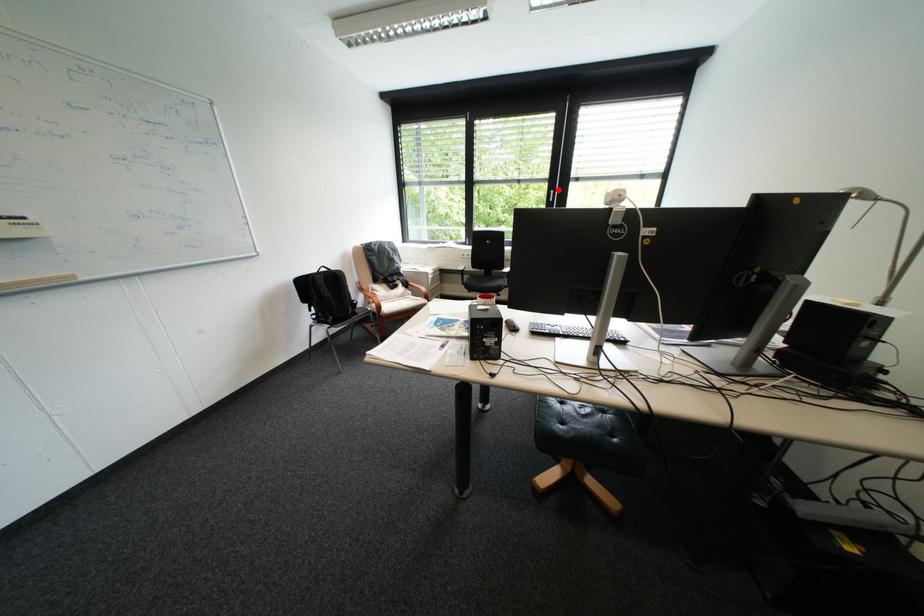
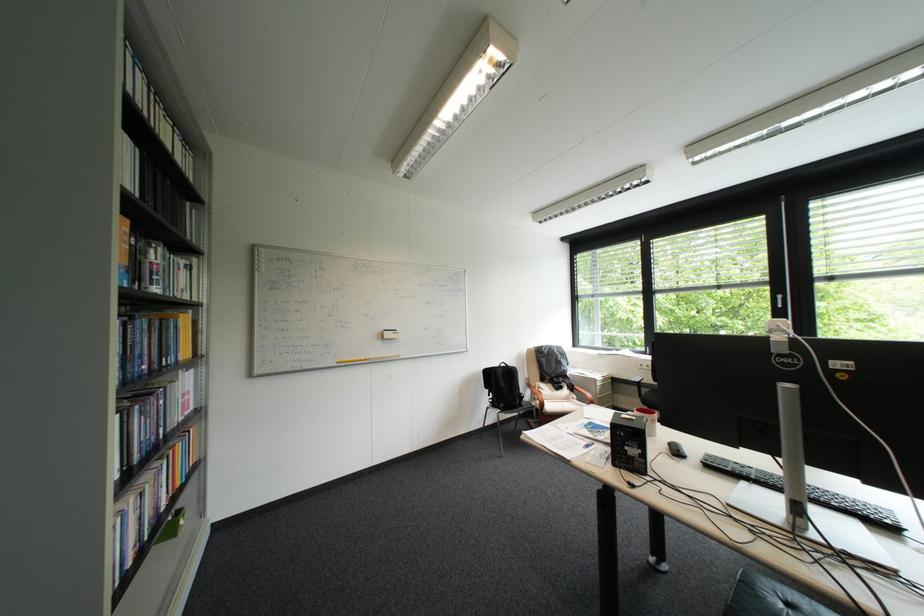
Question: A red point is marked in image1. In image2, is the corresponding 3D point closer to the camera or farther? Reply with the corresponding letter.

Choices:
 (A) The corresponding 3D point is closer.
 (B) The corresponding 3D point is farther.

Answer: (B)